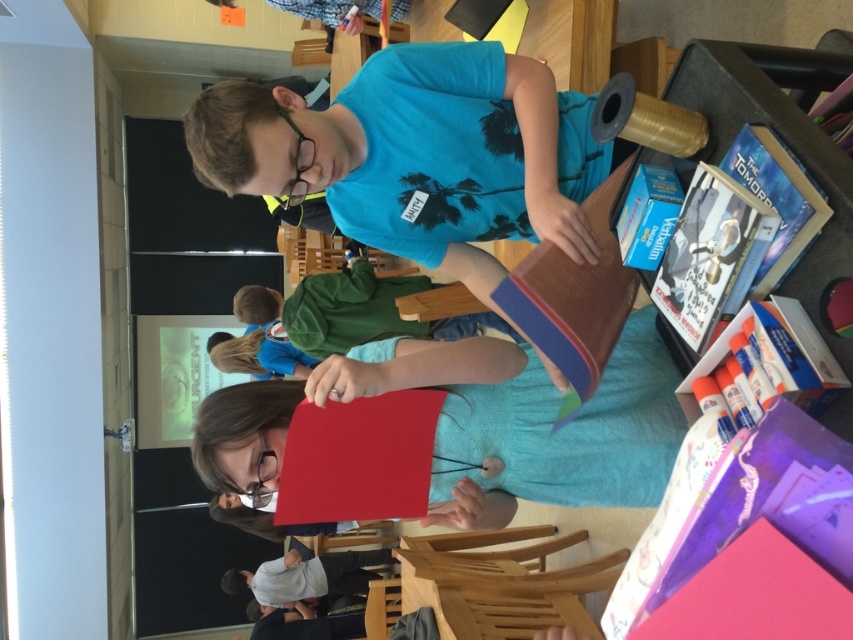
Question: Which object is closer to the camera taking this photo?

Choices:
 (A) smooth red paper at center
 (B) light gray cotton shirt at lower center

Answer: (A)

Question: Which of the following is the closest to the observer?

Choices:
 (A) (352, 582)
 (B) (309, 397)

Answer: (B)

Question: Does smooth red paper at center appear over light gray cotton shirt at lower center?

Choices:
 (A) no
 (B) yes

Answer: (B)

Question: Is smooth red paper at center to the right of light gray cotton shirt at lower center from the viewer's perspective?

Choices:
 (A) yes
 (B) no

Answer: (A)

Question: Can you confirm if smooth red paper at center is positioned to the left of light gray cotton shirt at lower center?

Choices:
 (A) yes
 (B) no

Answer: (B)